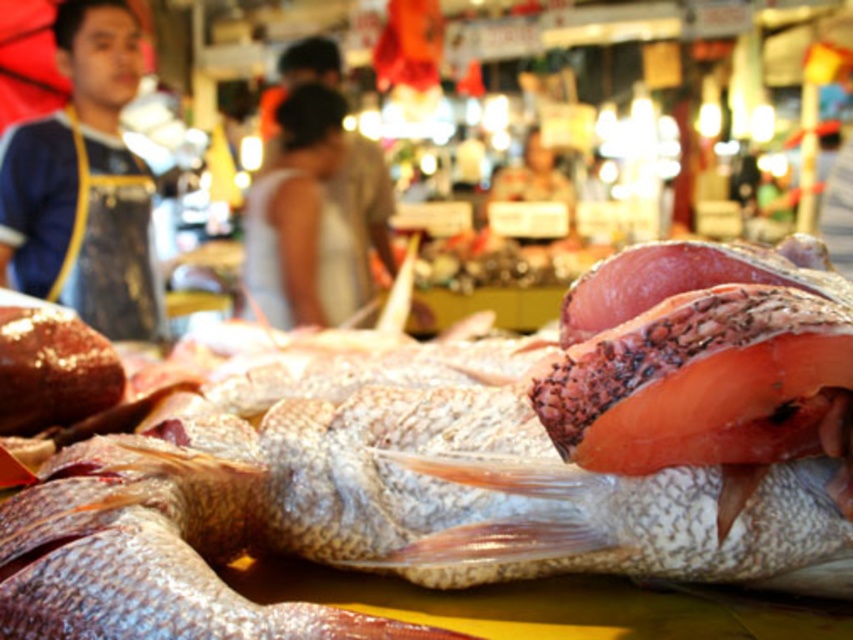
Who is more distant from viewer, (39, 161) or (263, 284)?

Point (263, 284)

Does blue apron at left have a larger size compared to white fabric dress at center?

Actually, blue apron at left might be smaller than white fabric dress at center.

The height and width of the screenshot is (640, 853). What are the coordinates of `blue apron at left` in the screenshot? It's located at (84, 184).

The image size is (853, 640). In order to click on blue apron at left in this screenshot , I will do `click(84, 184)`.